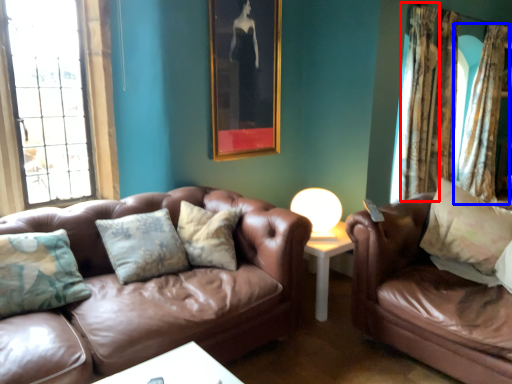
Question: Which of the following is the closest to the observer, curtain (highlighted by a red box) or curtain (highlighted by a blue box)?

Choices:
 (A) curtain
 (B) curtain

Answer: (A)